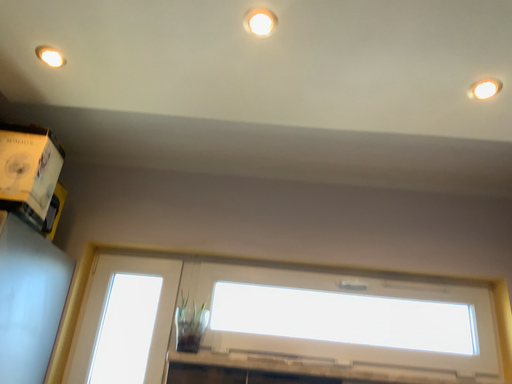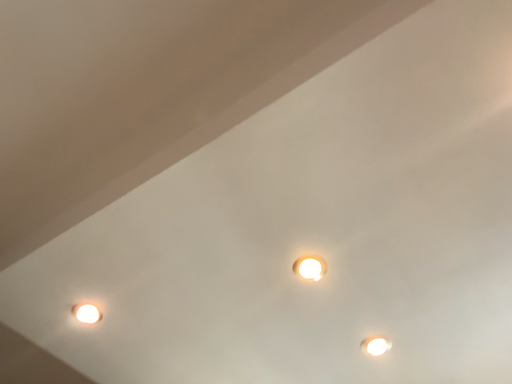
Question: Which way did the camera rotate in the video?

Choices:
 (A) rotated right
 (B) rotated left

Answer: (B)